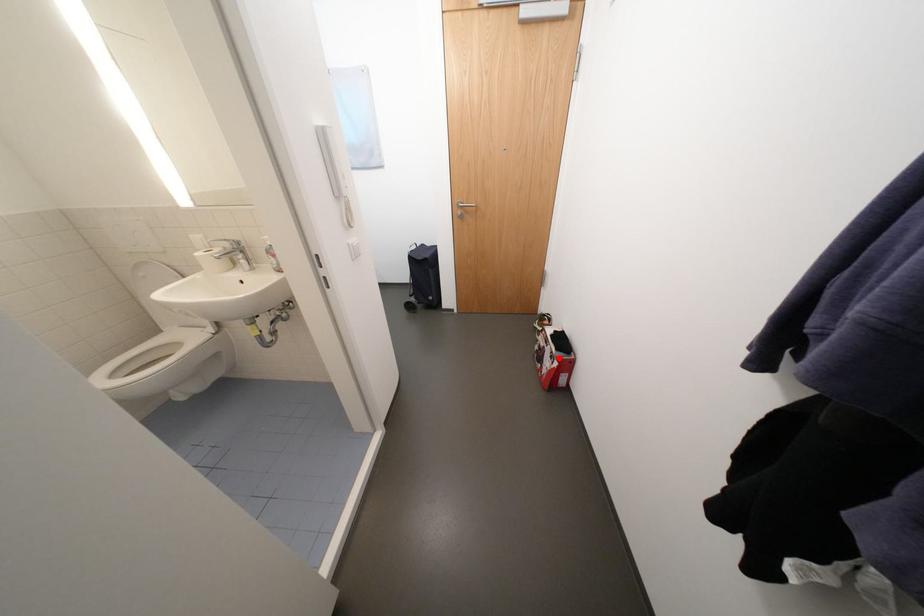
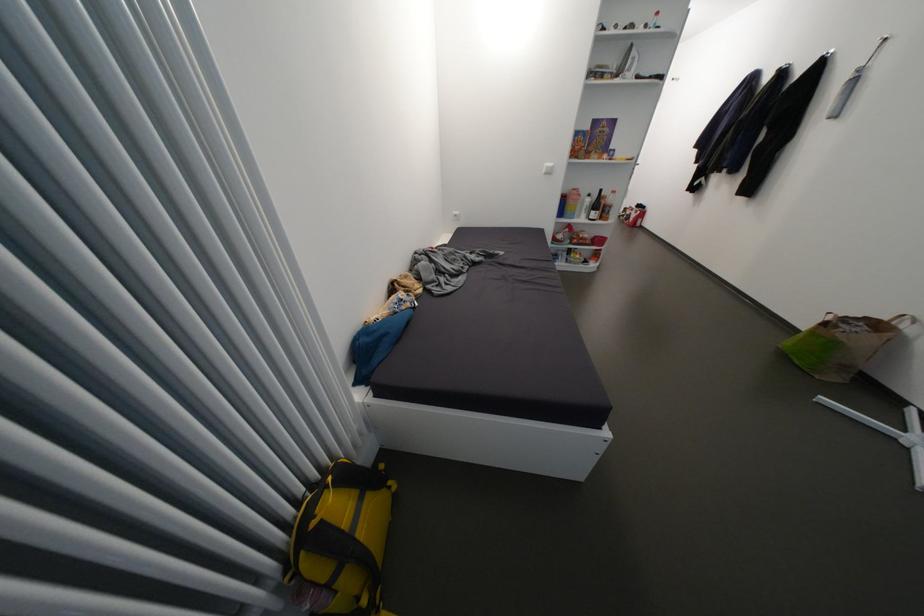
Question: I am providing you with two images of the same scene from different viewpoints. A red point is shown in image1. For the corresponding object point in image2, is it positioned nearer or farther from the camera?

Choices:
 (A) Nearer
 (B) Farther

Answer: (B)